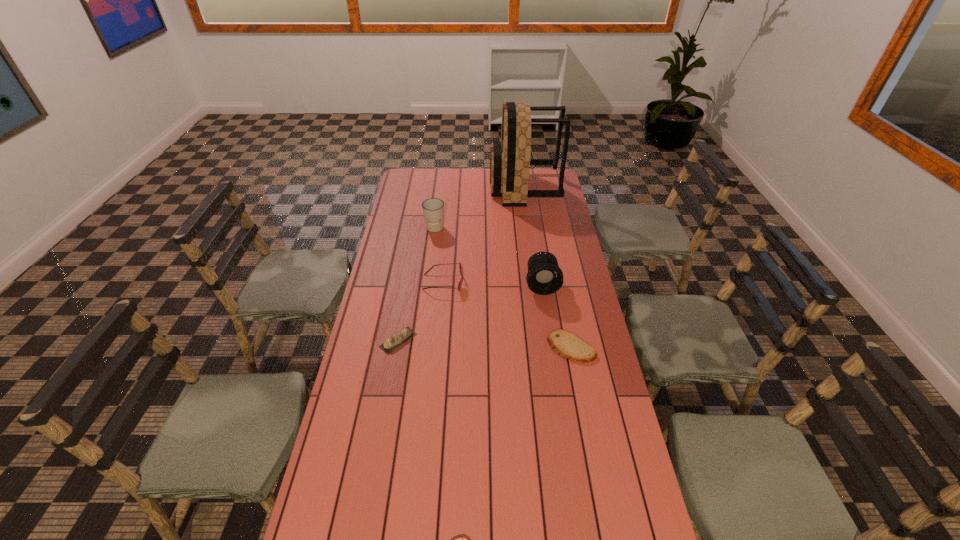
Find the location of a particular element. This screenshot has height=540, width=960. the farthest object is located at coordinates (510, 161).

Locate an element on the screen. The width and height of the screenshot is (960, 540). backpack is located at coordinates (510, 161).

The image size is (960, 540). Find the location of `telephoto lens`. telephoto lens is located at coordinates (544, 277).

Where is `the second farthest object`? the second farthest object is located at coordinates (433, 209).

At what (x,y) coordinates should I click in order to perform the action: click on the fourth tallest object. Please return your answer as a coordinate pair (x, y). The width and height of the screenshot is (960, 540). Looking at the image, I should click on (460, 266).

Where is `the leftmost pita bread`? Image resolution: width=960 pixels, height=540 pixels. the leftmost pita bread is located at coordinates (396, 340).

At what (x,y) coordinates should I click in order to perform the action: click on the rightmost pita bread. Please return your answer as a coordinate pair (x, y). Looking at the image, I should click on (566, 344).

The height and width of the screenshot is (540, 960). Find the location of `blank space located on the front face of the farthest object`. blank space located on the front face of the farthest object is located at coordinates (452, 188).

Find the location of a particular element. The width and height of the screenshot is (960, 540). vacant space located 0.100m on the front face of the farthest object is located at coordinates (471, 188).

The image size is (960, 540). Identify the location of vacant space located 0.300m on the front face of the farthest object. (433, 188).